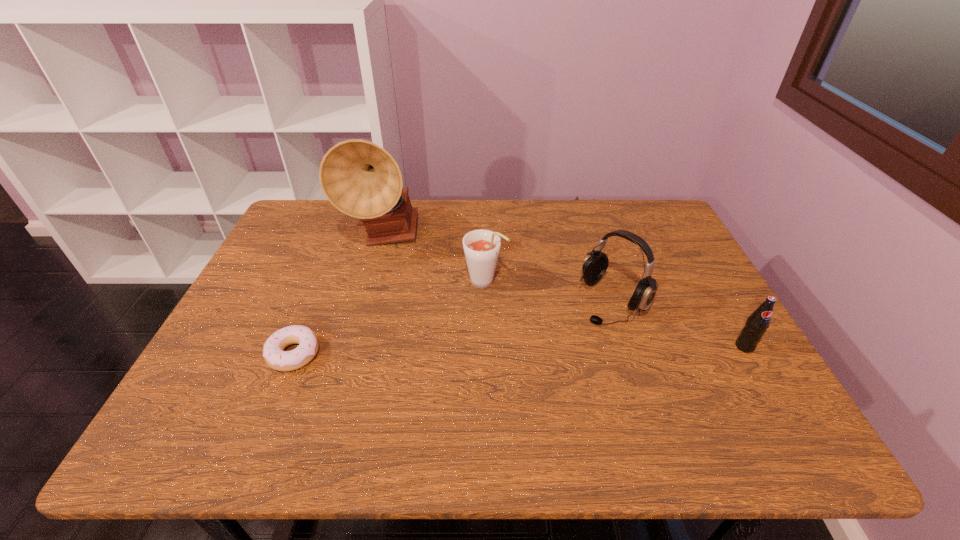
Where is `empty location between the phonograph record and the root beer`? The width and height of the screenshot is (960, 540). empty location between the phonograph record and the root beer is located at coordinates (434, 260).

Locate an element on the screen. vacant point located between the phonograph record and the pop is located at coordinates tap(564, 292).

Where is `free space between the third object from left to right and the tallest object`? This screenshot has width=960, height=540. free space between the third object from left to right and the tallest object is located at coordinates (434, 260).

Find the location of a particular element. This screenshot has width=960, height=540. free space between the shortest object and the tallest object is located at coordinates (338, 296).

Identify the location of vacant area that lies between the pop and the third object from right to left. This screenshot has width=960, height=540. (614, 314).

You are a GUI agent. You are given a task and a screenshot of the screen. Output one action in this format:
    pyautogui.click(x=<x>, y=<y>)
    Task: Click on the free spot between the rightmost object and the doughnut
    This screenshot has height=540, width=960.
    Given the screenshot: What is the action you would take?
    pyautogui.click(x=519, y=350)

Where is `free spot between the fourth object from left to right and the farthest object`? Image resolution: width=960 pixels, height=540 pixels. free spot between the fourth object from left to right and the farthest object is located at coordinates (497, 269).

Where is `free space that is in between the second shortest object and the doughnut`? The width and height of the screenshot is (960, 540). free space that is in between the second shortest object and the doughnut is located at coordinates (519, 350).

Choose which object is the second nearest neighbor to the shortest object. Please provide its 2D coordinates. Your answer should be formatted as a tuple, i.e. [(x, y)], where the tuple contains the x and y coordinates of a point satisfying the conditions above.

[(481, 247)]

Identify which object is located as the nearest to the pop. Please provide its 2D coordinates. Your answer should be formatted as a tuple, i.e. [(x, y)], where the tuple contains the x and y coordinates of a point satisfying the conditions above.

[(595, 264)]